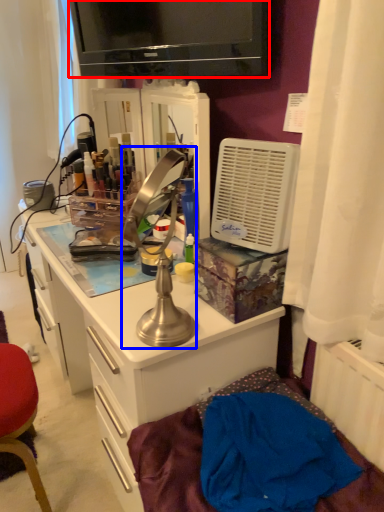
Question: Which object appears farthest to the camera in this image, television (highlighted by a red box) or table lamp (highlighted by a blue box)?

Choices:
 (A) television
 (B) table lamp

Answer: (A)